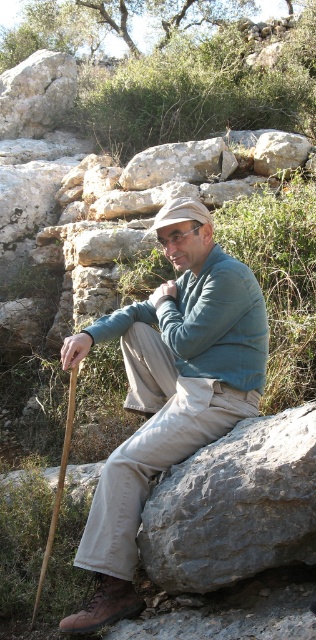
Is khaki cotton pants at center to the left of rough gray rock at center from the viewer's perspective?

Yes, khaki cotton pants at center is to the left of rough gray rock at center.

Where is `khaki cotton pants at center`? The width and height of the screenshot is (316, 640). khaki cotton pants at center is located at coordinates (169, 390).

Who is positioned more to the left, khaki cotton pants at center or gray rough rock at center?

khaki cotton pants at center

Who is lower down, khaki cotton pants at center or gray rough rock at center?

Positioned lower is gray rough rock at center.

Image resolution: width=316 pixels, height=640 pixels. I want to click on khaki cotton pants at center, so click(169, 390).

Identify the location of khaki cotton pants at center. (169, 390).

Who is lower down, gray rough rock at center or rough gray rock at center?

gray rough rock at center is lower down.

Does gray rough rock at center lie in front of rough gray rock at center?

Yes, it is.

Between point (268, 436) and point (151, 163), which one is positioned in front?

Positioned in front is point (268, 436).

What are the coordinates of `gray rough rock at center` in the screenshot? It's located at 235,506.